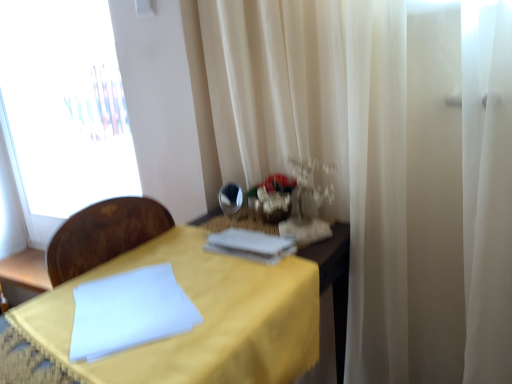
Question: Is point (125, 158) closer or farther from the camera than point (292, 248)?

Choices:
 (A) farther
 (B) closer

Answer: (A)

Question: In terms of height, does transparent glass window at left look taller or shorter compared to white paper at center?

Choices:
 (A) short
 (B) tall

Answer: (B)

Question: Based on their relative distances, which object is farther from the yellow fabric table at center?

Choices:
 (A) shiny silver mirror at center
 (B) white paper at center
 (C) transparent glass window at left

Answer: (C)

Question: Estimate the real-world distances between objects in this image. Which object is closer to the shiny silver mirror at center?

Choices:
 (A) white paper at center
 (B) transparent glass window at left
 (C) yellow fabric table at center

Answer: (A)